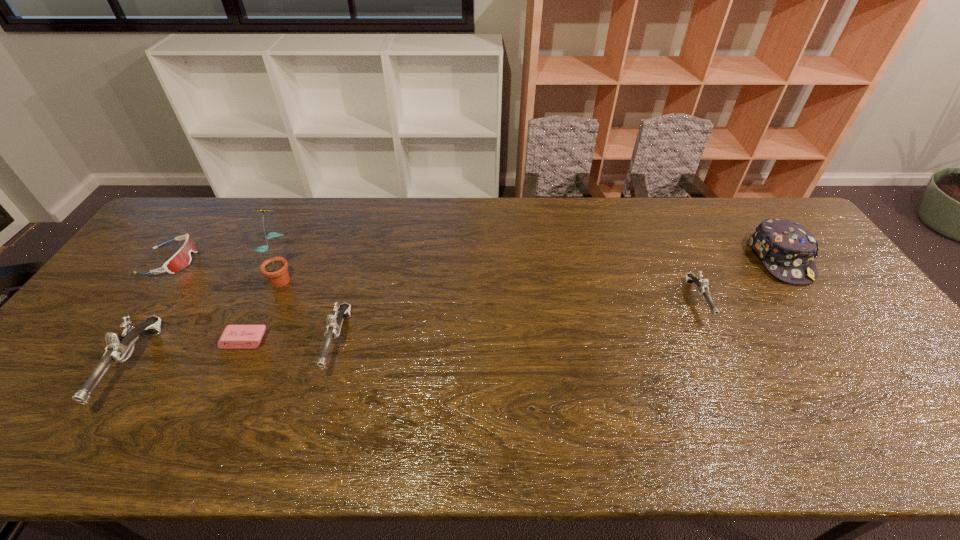
Please point a spot to place another gun for symmetrical spacing. Please provide its 2D coordinates. Your answer should be formatted as a tuple, i.e. [(x, y)], where the tuple contains the x and y coordinates of a point satisfying the conditions above.

[(526, 321)]